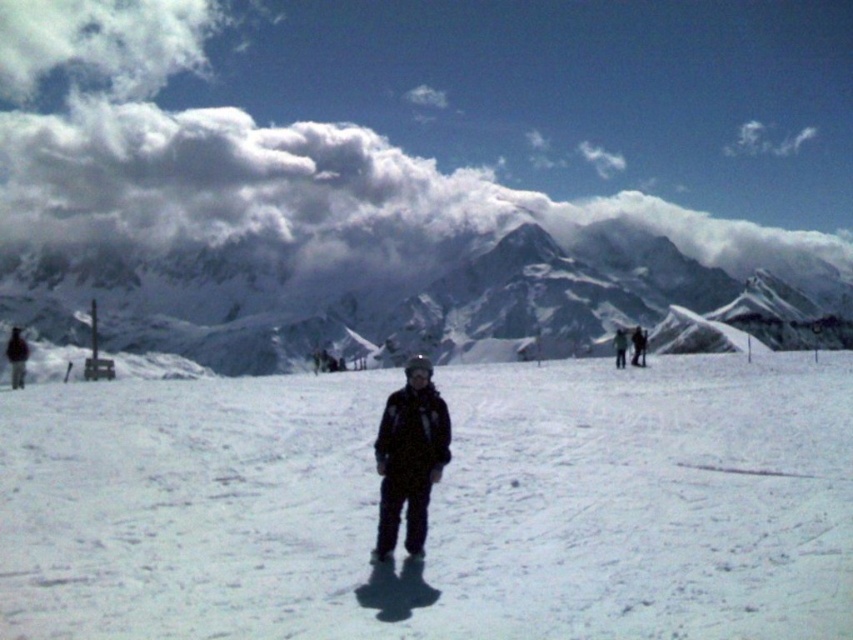
Is white snow at center in front of dark gray ski suit at center?

Yes, it is in front of dark gray ski suit at center.

Can you confirm if white snow at center is wider than dark gray ski suit at center?

Indeed, white snow at center has a greater width compared to dark gray ski suit at center.

Is point (62, 588) less distant than point (384, 461)?

That is True.

Locate an element on the screen. white snow at center is located at coordinates (436, 506).

Can you confirm if white fluffy cloud at upper center is wider than dark gray ski suit at center?

Yes, white fluffy cloud at upper center is wider than dark gray ski suit at center.

Can you confirm if white fluffy cloud at upper center is positioned to the right of dark gray ski suit at center?

Yes, white fluffy cloud at upper center is to the right of dark gray ski suit at center.

This screenshot has width=853, height=640. Describe the element at coordinates (427, 122) in the screenshot. I see `white fluffy cloud at upper center` at that location.

This screenshot has width=853, height=640. I want to click on white fluffy cloud at upper center, so click(x=427, y=122).

Can you confirm if white snow-covered mountain at upper center is smaller than dark gray ski suit at center?

No.

Does white snow-covered mountain at upper center appear over dark gray ski suit at center?

Yes, white snow-covered mountain at upper center is above dark gray ski suit at center.

This screenshot has height=640, width=853. What are the coordinates of `white snow-covered mountain at upper center` in the screenshot? It's located at pos(421,300).